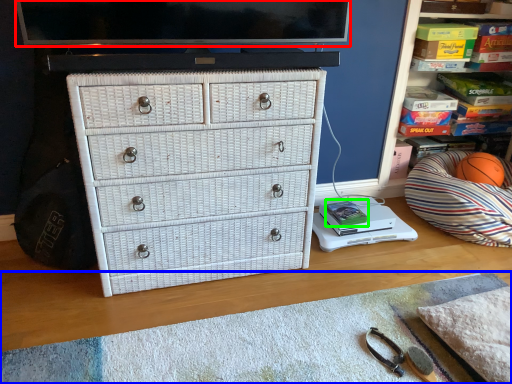
Question: Estimate the real-world distances between objects in this image. Which object is farther from television (highlighted by a red box), plain (highlighted by a blue box) or book (highlighted by a green box)?

Choices:
 (A) plain
 (B) book

Answer: (B)